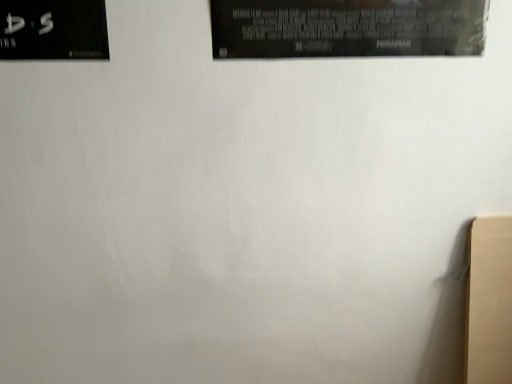
Based on the photo, measure the distance between point [509,260] and camera.

Point [509,260] and camera are 1.06 meters apart from each other.

Describe the element at coordinates (489, 301) in the screenshot. This screenshot has width=512, height=384. I see `beige cardboard box at lower right` at that location.

This screenshot has height=384, width=512. In order to click on beige cardboard box at lower right in this screenshot , I will do `click(489, 301)`.

You are a GUI agent. You are given a task and a screenshot of the screen. Output one action in this format:
    pyautogui.click(x=<x>, y=<y>)
    Task: Click on the beige cardboard box at lower right
    
    Given the screenshot: What is the action you would take?
    pyautogui.click(x=489, y=301)